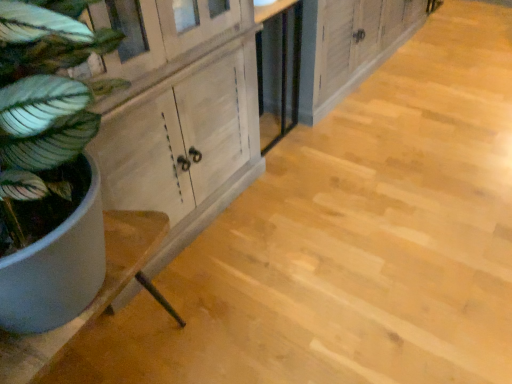
Question: Is green matte plant at left behind white wood counter at left?

Choices:
 (A) yes
 (B) no

Answer: (B)

Question: Is green matte plant at left not near white wood counter at left?

Choices:
 (A) no
 (B) yes

Answer: (A)

Question: Does green matte plant at left have a larger size compared to white wood counter at left?

Choices:
 (A) yes
 (B) no

Answer: (A)

Question: Is green matte plant at left shorter than white wood counter at left?

Choices:
 (A) yes
 (B) no

Answer: (B)

Question: Can you confirm if green matte plant at left is wider than white wood counter at left?

Choices:
 (A) no
 (B) yes

Answer: (B)

Question: From a real-world perspective, is green matte plant at left positioned over white wood counter at left based on gravity?

Choices:
 (A) no
 (B) yes

Answer: (B)

Question: Does white wood counter at left have a smaller size compared to green matte plant at left?

Choices:
 (A) no
 (B) yes

Answer: (B)

Question: Is white wood counter at left to the right of green matte plant at left from the viewer's perspective?

Choices:
 (A) no
 (B) yes

Answer: (A)

Question: Is white wood counter at left further to camera compared to green matte plant at left?

Choices:
 (A) no
 (B) yes

Answer: (B)

Question: Is white wood counter at left surrounding green matte plant at left?

Choices:
 (A) no
 (B) yes

Answer: (A)

Question: Can you confirm if white wood counter at left is bigger than green matte plant at left?

Choices:
 (A) no
 (B) yes

Answer: (A)

Question: Is white wood counter at left positioned with its back to green matte plant at left?

Choices:
 (A) yes
 (B) no

Answer: (B)

Question: Does green matte plant at left have a larger size compared to wooden cabinet at center?

Choices:
 (A) no
 (B) yes

Answer: (A)